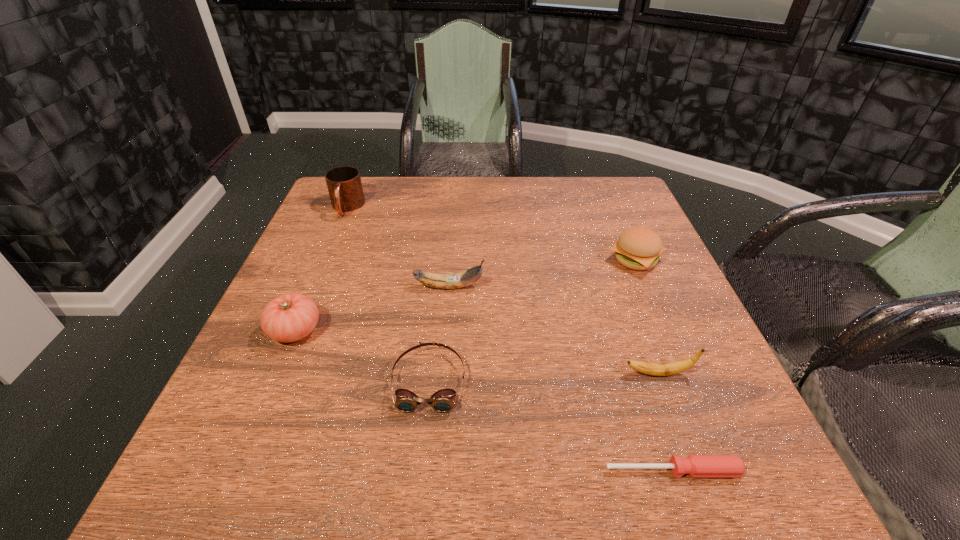
Identify the location of vacant space located on the side of the mug with the handle. The width and height of the screenshot is (960, 540). (300, 320).

Identify the location of free space located at the stem of the farther banana. This screenshot has height=540, width=960. [646, 287].

At what (x,y) coordinates should I click in order to perform the action: click on blank space located on the back of the hamburger. Please return your answer as a coordinate pair (x, y). The width and height of the screenshot is (960, 540). Looking at the image, I should click on (619, 223).

This screenshot has height=540, width=960. Find the location of `vacant region located 0.110m on the back of the tomato`. vacant region located 0.110m on the back of the tomato is located at coordinates (318, 277).

Find the location of a particular element. This screenshot has height=540, width=960. vacant space located 0.070m on the peel of the shorter banana from the top is located at coordinates (586, 374).

Locate an element on the screen. The height and width of the screenshot is (540, 960). vacant area situated 0.080m on the peel of the shorter banana from the top is located at coordinates (580, 374).

Find the location of a particular element. The height and width of the screenshot is (540, 960). vacant space positioned on the peel of the shorter banana from the top is located at coordinates (531, 374).

This screenshot has width=960, height=540. I want to click on vacant space located 0.080m through the lenses of the goggles, so click(420, 460).

Locate an element on the screen. This screenshot has height=540, width=960. vacant space located 0.150m on the left of the screwdriver is located at coordinates tap(507, 470).

The height and width of the screenshot is (540, 960). I want to click on object positioned at the far edge, so click(344, 184).